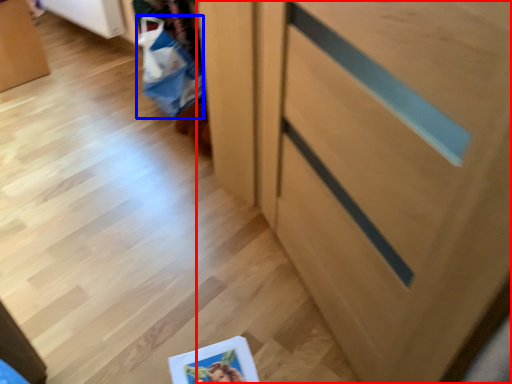
Question: Which object is further to the camera taking this photo, cabinetry (highlighted by a red box) or shopping bag (highlighted by a blue box)?

Choices:
 (A) cabinetry
 (B) shopping bag

Answer: (B)